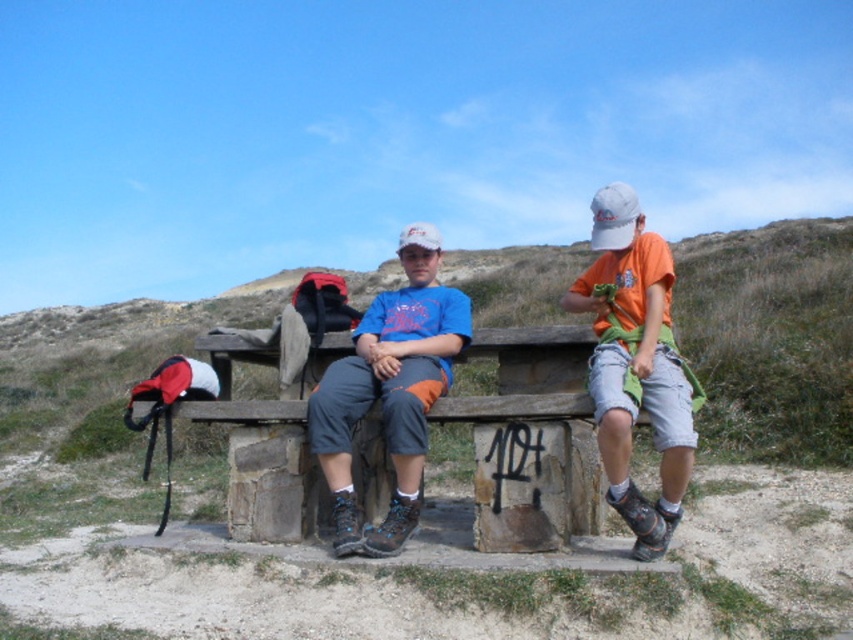
Question: Estimate the real-world distances between objects in this image. Which object is farther from the wooden bench at center?

Choices:
 (A) orange cotton shirt at right
 (B) matte blue t-shirt at center

Answer: (B)

Question: Does wooden bench at center appear on the left side of orange cotton shirt at right?

Choices:
 (A) yes
 (B) no

Answer: (A)

Question: Which point appears farthest from the camera in this image?

Choices:
 (A) (640, 246)
 (B) (466, 408)
 (C) (442, 392)

Answer: (C)

Question: Can you confirm if orange cotton shirt at right is positioned above matte blue t-shirt at center?

Choices:
 (A) no
 (B) yes

Answer: (B)

Question: Considering the relative positions of orange cotton shirt at right and matte blue t-shirt at center in the image provided, where is orange cotton shirt at right located with respect to matte blue t-shirt at center?

Choices:
 (A) left
 (B) right

Answer: (B)

Question: Among these points, which one is farthest from the camera?

Choices:
 (A) (256, 524)
 (B) (448, 381)
 (C) (665, 288)

Answer: (A)